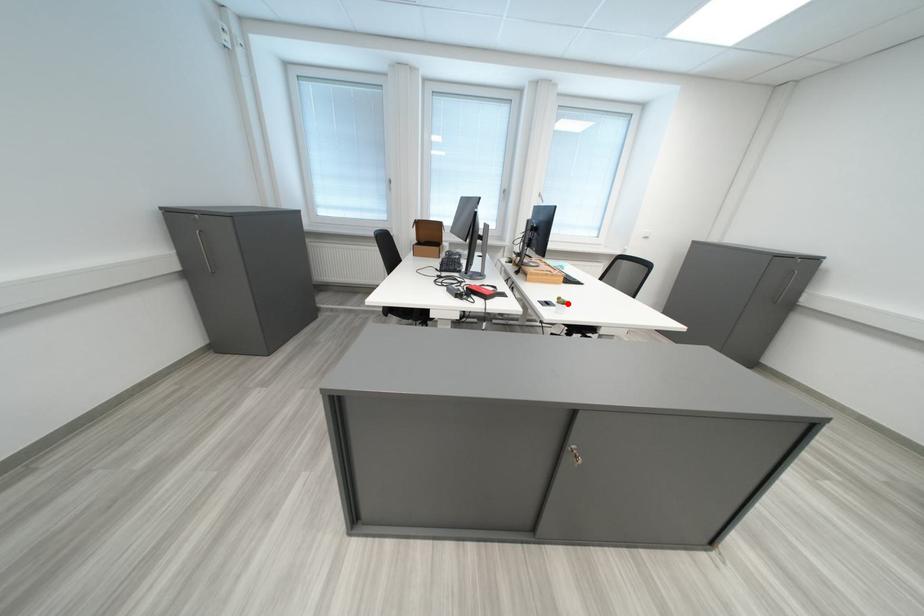
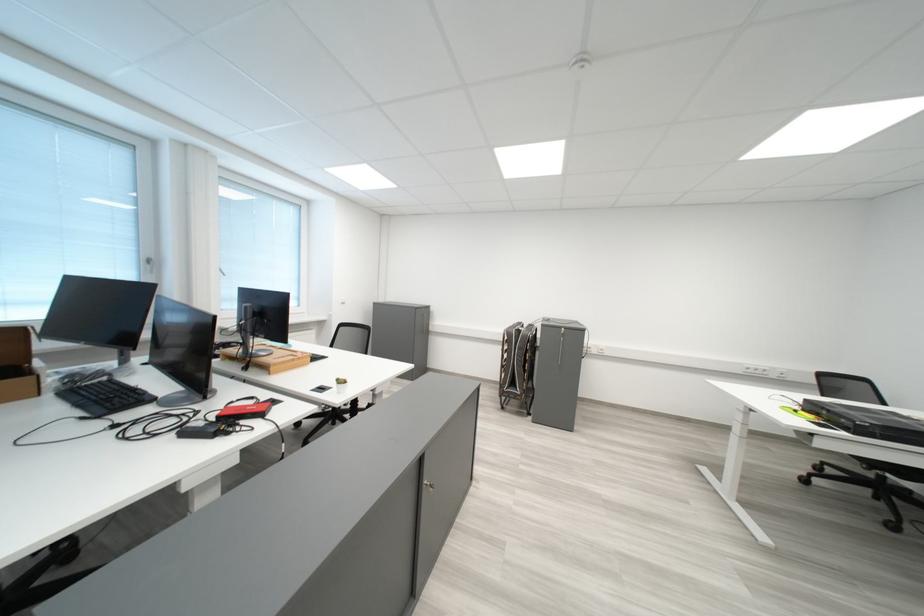
Locate, in the second image, the point that corresponds to the highlighted location in the first image.

(345, 386)